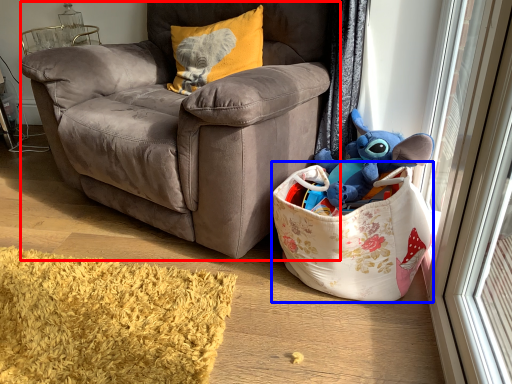
Question: Which object is closer to the camera taking this photo, chair (highlighted by a red box) or gift basket (highlighted by a blue box)?

Choices:
 (A) chair
 (B) gift basket

Answer: (A)